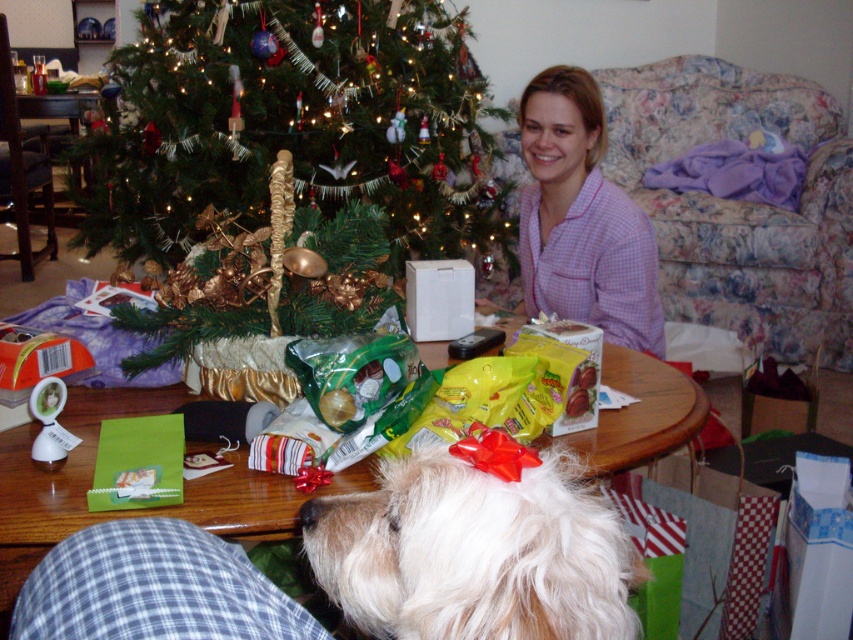
Is wooden table at center smaller than pink checkered pajamas at center?

Indeed, wooden table at center has a smaller size compared to pink checkered pajamas at center.

Does point (258, 496) lie in front of point (579, 128)?

Yes, it is in front of point (579, 128).

Which is behind, point (614, 420) or point (572, 307)?

Point (572, 307)

The image size is (853, 640). Find the location of `wooden table at center`. wooden table at center is located at coordinates (132, 509).

Based on the photo, does green matte christmas tree at upper left have a smaller size compared to white fluffy dog at center?

Actually, green matte christmas tree at upper left might be larger than white fluffy dog at center.

Is point (440, 60) more distant than point (363, 536)?

That is True.

Which is behind, point (412, 93) or point (515, 632)?

The point (412, 93) is more distant.

Locate an element on the screen. This screenshot has width=853, height=640. green matte christmas tree at upper left is located at coordinates (294, 125).

Between green matte christmas tree at upper left and pink checkered pajamas at center, which one is positioned higher?

green matte christmas tree at upper left

Who is shorter, green matte christmas tree at upper left or pink checkered pajamas at center?

pink checkered pajamas at center is shorter.

Which is in front, point (389, 173) or point (553, 154)?

Positioned in front is point (553, 154).

Image resolution: width=853 pixels, height=640 pixels. Identify the location of green matte christmas tree at upper left. (294, 125).